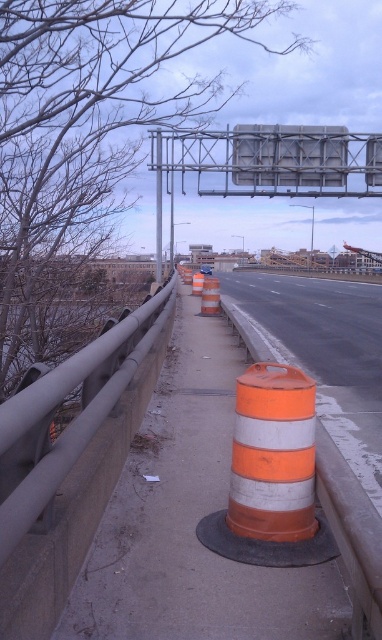
You are a delivery driver who needs to navigate through the construction zone. You see an orange striped barrel at center and a metallic gray sign at upper center. Which object is narrower?

The orange striped barrel at center is narrower than the metallic gray sign at upper center.